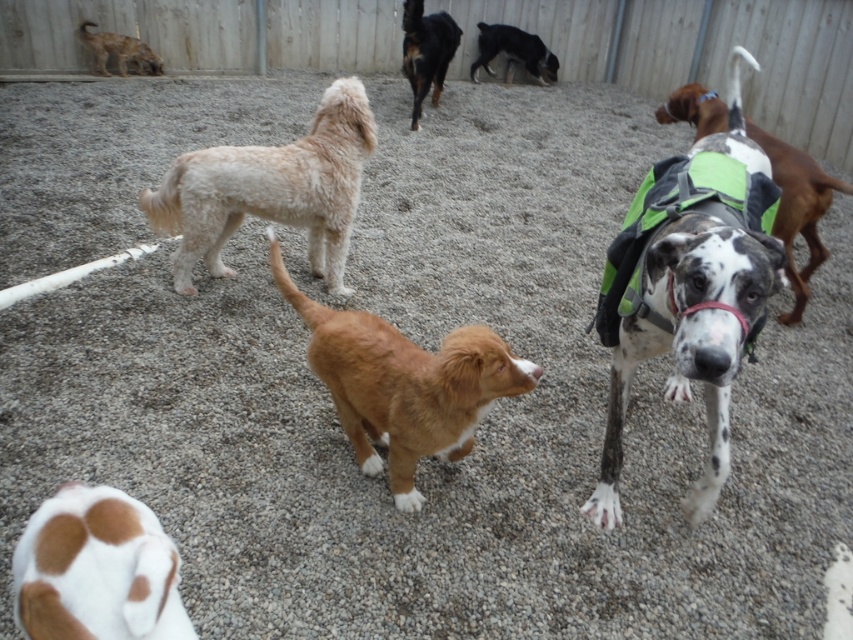
Which is behind, point (492, 385) or point (357, 186)?

Point (357, 186)

The image size is (853, 640). What are the coordinates of `brown fuzzy dog at center` in the screenshot? It's located at (403, 385).

Which is more to the left, light beige fur at center or smooth wood pole at upper center?

Positioned to the left is smooth wood pole at upper center.

Does light beige fur at center have a lesser width compared to smooth wood pole at upper center?

No, light beige fur at center is not thinner than smooth wood pole at upper center.

Which is behind, point (186, 154) or point (256, 42)?

Point (256, 42)

Image resolution: width=853 pixels, height=640 pixels. What are the coordinates of `light beige fur at center` in the screenshot? It's located at (270, 189).

Who is shorter, black and white fur at center or smooth wood pole at upper center?

With less height is black and white fur at center.

Is point (525, 65) closer to viewer compared to point (257, 26)?

No, it is behind (257, 26).

Identify the location of black and white fur at center. This screenshot has width=853, height=640. (514, 52).